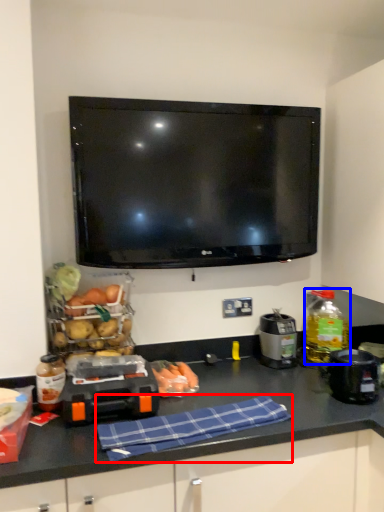
Question: Which object is closer to the camera taking this photo, cloth (highlighted by a red box) or bottle (highlighted by a blue box)?

Choices:
 (A) cloth
 (B) bottle

Answer: (A)